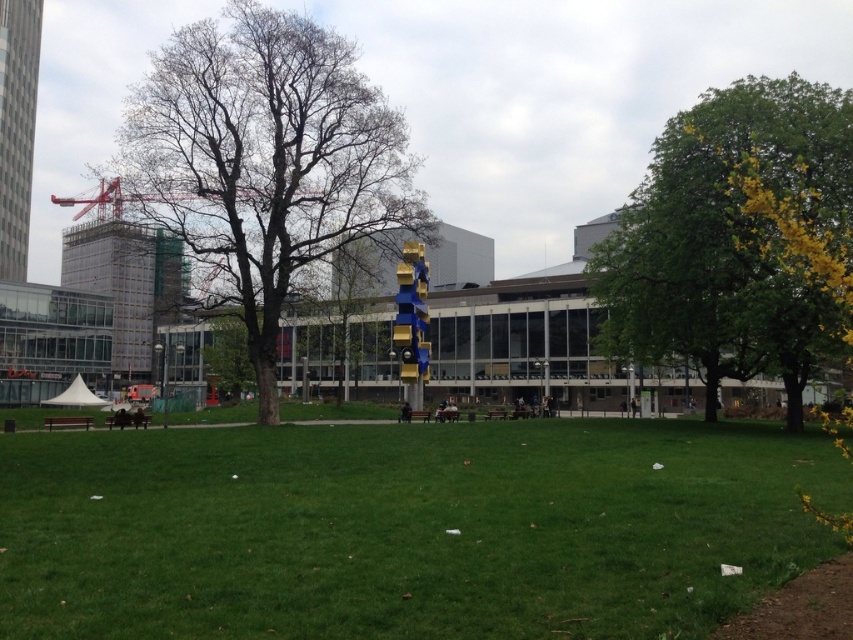
Who is lower down, bare wood tree at center or red metal crane at upper left?

bare wood tree at center

Locate an element on the screen. The image size is (853, 640). bare wood tree at center is located at coordinates (x=265, y=161).

Who is higher up, bare wood tree at center or green leafy tree at right?

green leafy tree at right is higher up.

Does bare wood tree at center appear under green leafy tree at right?

Yes, bare wood tree at center is below green leafy tree at right.

Is point (178, 131) behind point (608, 266)?

No, it is in front of (608, 266).

I want to click on bare wood tree at center, so click(x=265, y=161).

Can you confirm if green grass at center is smaller than green leafy tree at right?

Indeed, green grass at center has a smaller size compared to green leafy tree at right.

Is green grass at center above green leafy tree at right?

Actually, green grass at center is below green leafy tree at right.

The height and width of the screenshot is (640, 853). What do you see at coordinates (405, 529) in the screenshot?
I see `green grass at center` at bounding box center [405, 529].

The image size is (853, 640). I want to click on green grass at center, so click(405, 529).